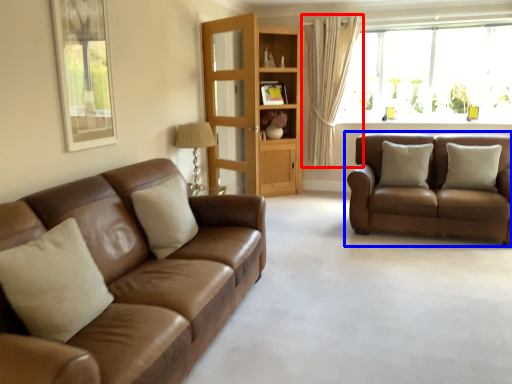
Question: Which of the following is the farthest to the observer, curtain (highlighted by a red box) or studio couch (highlighted by a blue box)?

Choices:
 (A) curtain
 (B) studio couch

Answer: (A)